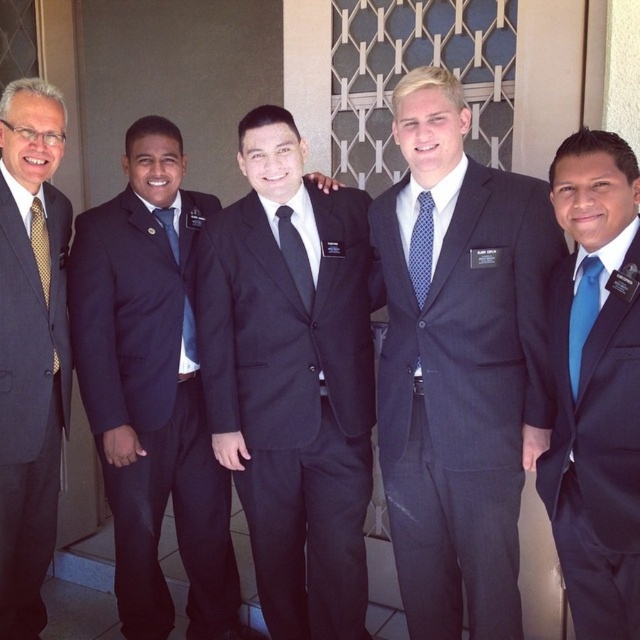
Which is below, black pinstripe suit at center or matte blue tie at left?

black pinstripe suit at center

In the scene shown: Is black pinstripe suit at center wider than matte blue tie at left?

Yes, black pinstripe suit at center is wider than matte blue tie at left.

Measure the distance between point (212, 356) and camera.

A distance of 2.44 meters exists between point (212, 356) and camera.

This screenshot has height=640, width=640. Find the location of `black pinstripe suit at center`. black pinstripe suit at center is located at coordinates (291, 381).

Is black pinstripe suit at center taller than matte gold tie at left?

No.

Does point (316, 451) come behind point (49, 452)?

No, it is in front of (49, 452).

Between point (252, 212) and point (20, 188), which one is positioned behind?

The point (252, 212) is more distant.

This screenshot has height=640, width=640. Find the location of `black pinstripe suit at center`. black pinstripe suit at center is located at coordinates coord(291,381).

Does navy pinstripe suit at center have a greater height compared to matte blue tie at left?

Yes.

Is navy pinstripe suit at center smaller than matte blue tie at left?

No, navy pinstripe suit at center is not smaller than matte blue tie at left.

Who is more forward, (163,280) or (161,225)?

Point (163,280)

At what (x,y) coordinates should I click in order to perform the action: click on navy pinstripe suit at center. Please return your answer as a coordinate pair (x, y). Image resolution: width=640 pixels, height=640 pixels. Looking at the image, I should click on (150, 410).